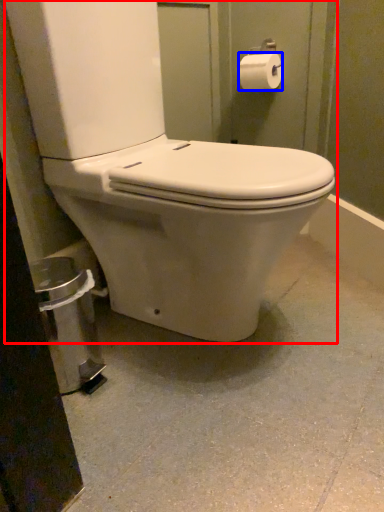
Question: Among these objects, which one is nearest to the camera, toilet (highlighted by a red box) or toilet paper (highlighted by a blue box)?

Choices:
 (A) toilet
 (B) toilet paper

Answer: (A)